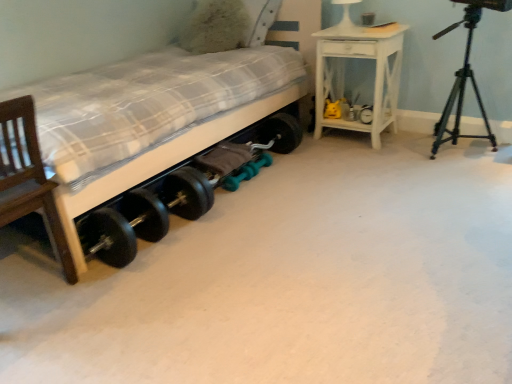
At what (x,y) coordinates should I click in order to perform the action: click on vacant area that lies between white painted wood nightstand at upper right and black metal tripod at right. Please return your answer as a coordinate pair (x, y). The image size is (512, 384). Looking at the image, I should click on (408, 149).